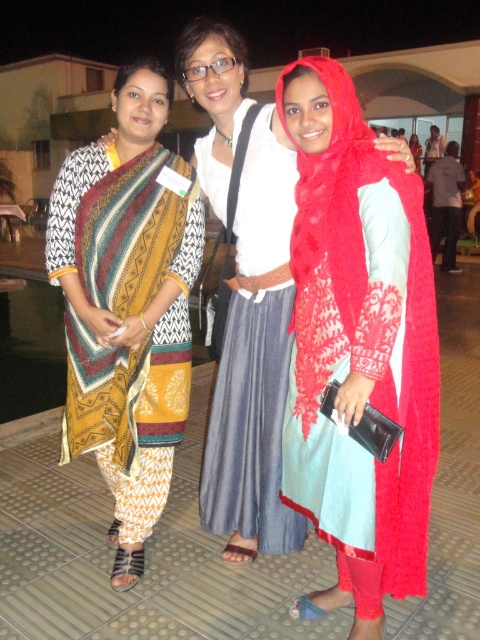
Can you confirm if red lace scarf at center is positioned below printed cotton dress at left?

Indeed, red lace scarf at center is positioned under printed cotton dress at left.

Is point (344, 513) closer to camera compared to point (166, 468)?

Yes.

In order to click on red lace scarf at center in this screenshot , I will do `click(358, 346)`.